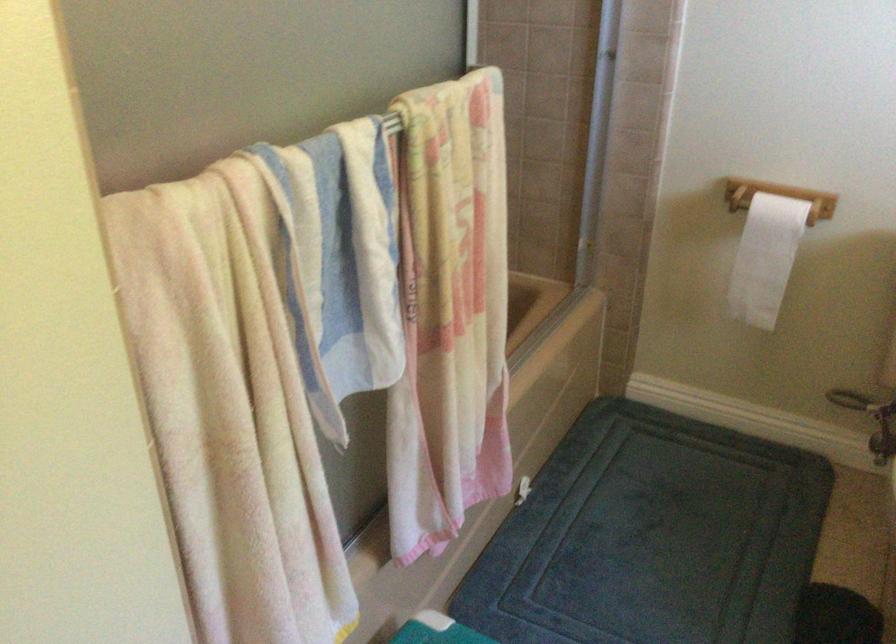
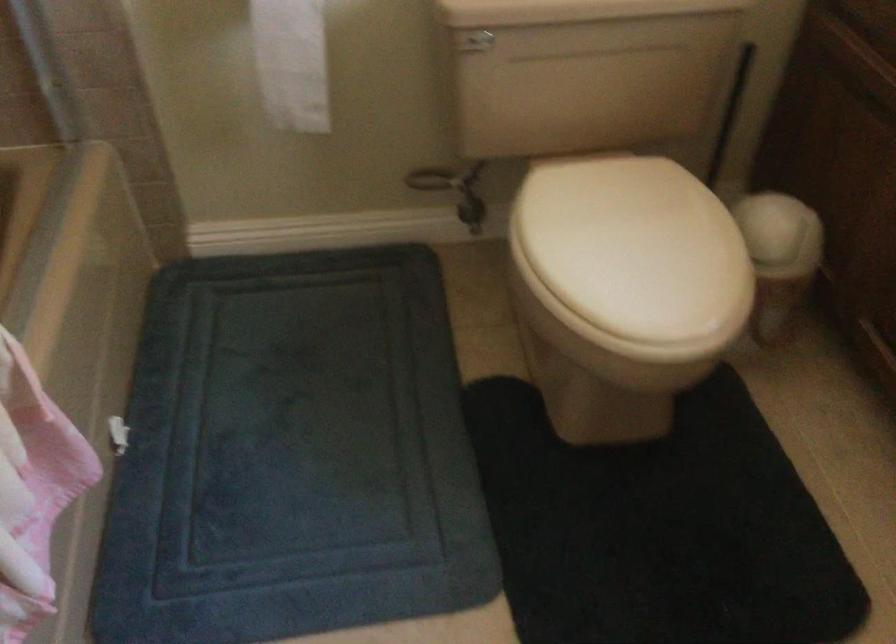
Based on the photo, based on the continuous images, in which direction is the camera rotating?

The rotation direction of the camera is right-down.